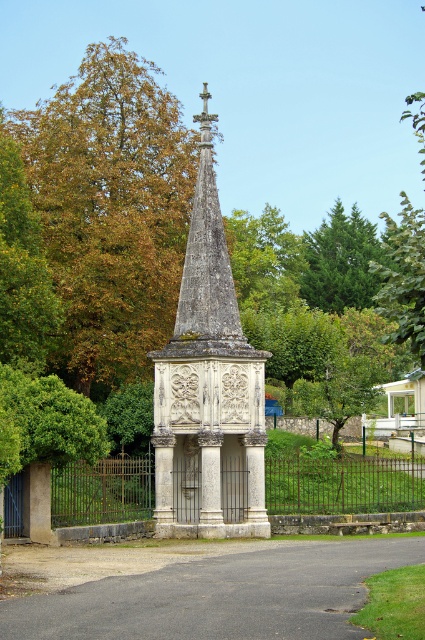
Question: Which object is positioned farthest from the brown metal fence at center?

Choices:
 (A) white stone monument at center
 (B) green coniferous tree at upper right

Answer: (B)

Question: Which object appears farthest from the camera in this image?

Choices:
 (A) white stone monument at center
 (B) green coniferous tree at upper right

Answer: (B)

Question: Is white stone monument at center thinner than green coniferous tree at upper right?

Choices:
 (A) yes
 (B) no

Answer: (A)

Question: Is white stone monument at center positioned in front of brown metal fence at center?

Choices:
 (A) no
 (B) yes

Answer: (A)

Question: Does white stone monument at center appear on the left side of brown metal fence at center?

Choices:
 (A) yes
 (B) no

Answer: (A)

Question: Considering the real-world distances, which object is farthest from the white stone monument at center?

Choices:
 (A) brown metal fence at center
 (B) green coniferous tree at upper right

Answer: (B)